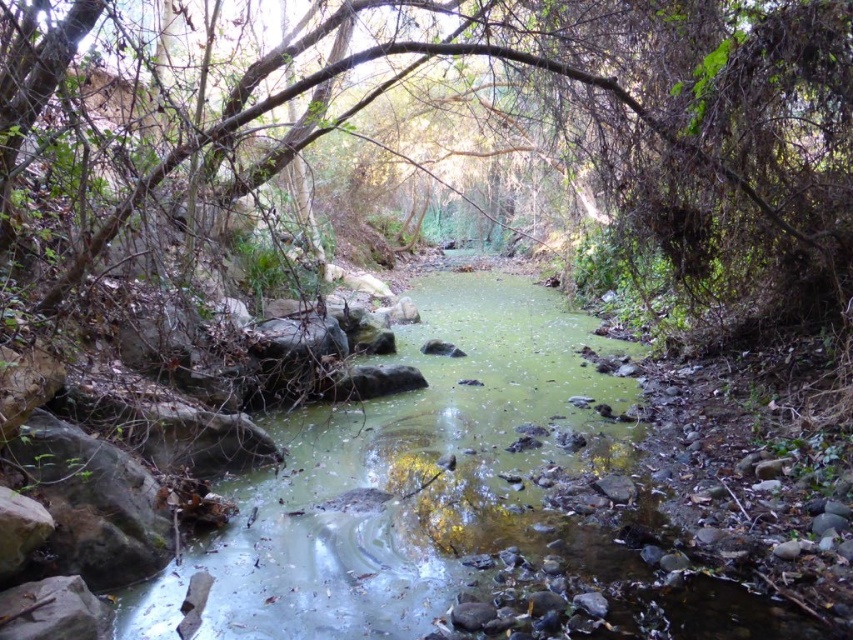
Which is behind, point (164, 572) or point (827, 176)?

The point (827, 176) is more distant.

Is green algae-covered water at center to the right of green leafy tree at center from the viewer's perspective?

Incorrect, green algae-covered water at center is not on the right side of green leafy tree at center.

You are a GUI agent. You are given a task and a screenshot of the screen. Output one action in this format:
    pyautogui.click(x=<x>, y=<y>)
    Task: Click on the green algae-covered water at center
    The image size is (853, 640).
    Given the screenshot: What is the action you would take?
    pyautogui.click(x=421, y=480)

Locate an element on the screen. Image resolution: width=853 pixels, height=640 pixels. green algae-covered water at center is located at coordinates (421, 480).